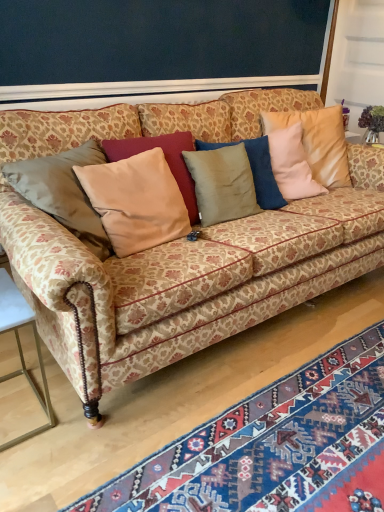
Find the location of `free space below gold metallic table at lower left (from a real-world perspective)`. free space below gold metallic table at lower left (from a real-world perspective) is located at coordinates (19, 411).